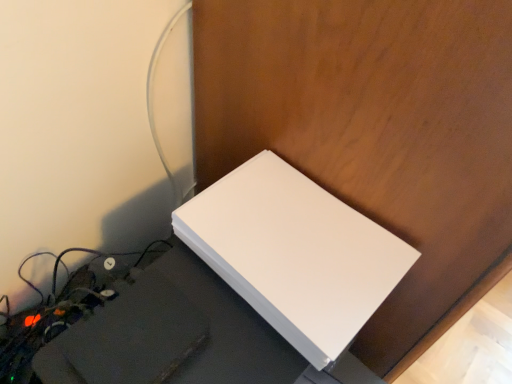
You are a GUI agent. You are given a task and a screenshot of the screen. Output one action in this format:
    pyautogui.click(x=<x>, y=<y>)
    Task: Click on the blank space situated above white matte wii at center (from a real-world perspective)
    
    Given the screenshot: What is the action you would take?
    pyautogui.click(x=298, y=238)